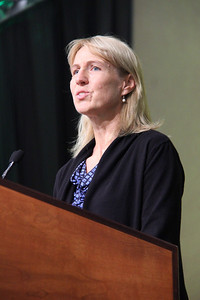
The height and width of the screenshot is (300, 200). I want to click on green wall, so click(x=193, y=95).